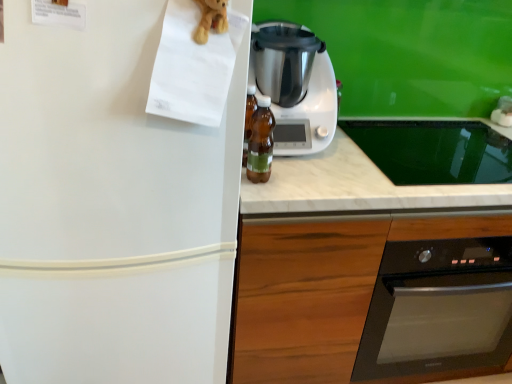
The height and width of the screenshot is (384, 512). Identify the location of free spot in front of white plastic blender at center. 318,180.